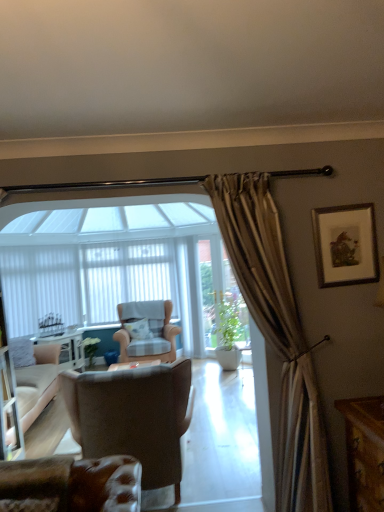
Question: From the image's perspective, is brown leather chair at center, which ranks as the second chair in back-to-front order, over green glossy plant at center, which is the first plant in right-to-left order?

Choices:
 (A) yes
 (B) no

Answer: (B)

Question: Considering the relative sizes of brown leather chair at center, placed as the second chair when sorted from front to back, and green glossy plant at center, which ranks as the 2th plant in left-to-right order, in the image provided, is brown leather chair at center, placed as the second chair when sorted from front to back, bigger than green glossy plant at center, which ranks as the 2th plant in left-to-right order,?

Choices:
 (A) yes
 (B) no

Answer: (A)

Question: Considering the relative sizes of brown leather chair at center, which ranks as the second chair in back-to-front order, and green glossy plant at center, which ranks as the 2th plant in left-to-right order, in the image provided, is brown leather chair at center, which ranks as the second chair in back-to-front order, taller than green glossy plant at center, which ranks as the 2th plant in left-to-right order,?

Choices:
 (A) no
 (B) yes

Answer: (A)

Question: From the image's perspective, is brown leather chair at center, placed as the second chair when sorted from front to back, beneath green glossy plant at center, which ranks as the 2th plant in back-to-front order?

Choices:
 (A) yes
 (B) no

Answer: (A)

Question: Is brown leather chair at center, placed as the second chair when sorted from front to back, to the left of green glossy plant at center, which is the first plant in right-to-left order, from the viewer's perspective?

Choices:
 (A) no
 (B) yes

Answer: (B)

Question: Can we say brown leather chair at center, which ranks as the second chair in back-to-front order, lies outside green glossy plant at center, arranged as the 1th plant when viewed from the front?

Choices:
 (A) no
 (B) yes

Answer: (B)

Question: From the image's perspective, does white fabric curtain at left appear lower than white textured pillow at center?

Choices:
 (A) yes
 (B) no

Answer: (B)

Question: Is white fabric curtain at left far from white textured pillow at center?

Choices:
 (A) no
 (B) yes

Answer: (B)

Question: Does white fabric curtain at left have a greater width compared to white textured pillow at center?

Choices:
 (A) yes
 (B) no

Answer: (B)

Question: Is white textured pillow at center completely or partially inside white fabric curtain at left?

Choices:
 (A) yes
 (B) no

Answer: (B)

Question: Is white fabric curtain at left looking in the opposite direction of white textured pillow at center?

Choices:
 (A) no
 (B) yes

Answer: (A)

Question: From a real-world perspective, is white fabric curtain at left located higher than white textured pillow at center?

Choices:
 (A) yes
 (B) no

Answer: (A)

Question: Considering the relative sizes of checkered fabric armchair at center, which is counted as the third chair, starting from the front, and leather at lower left, the first chair when ordered from front to back, in the image provided, is checkered fabric armchair at center, which is counted as the third chair, starting from the front, smaller than leather at lower left, the first chair when ordered from front to back,?

Choices:
 (A) no
 (B) yes

Answer: (A)